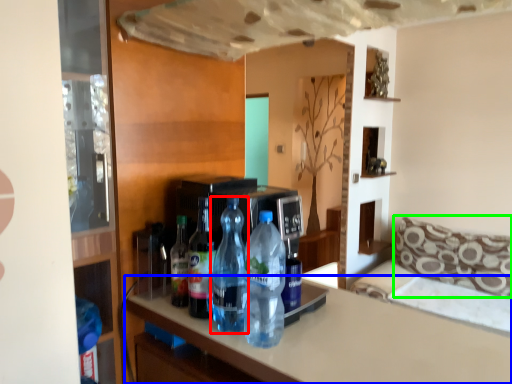
Question: Based on their relative distances, which object is nearer to bottle (highlighted by a red box)? Choose from countertop (highlighted by a blue box) and pillow (highlighted by a green box).

Choices:
 (A) countertop
 (B) pillow

Answer: (A)